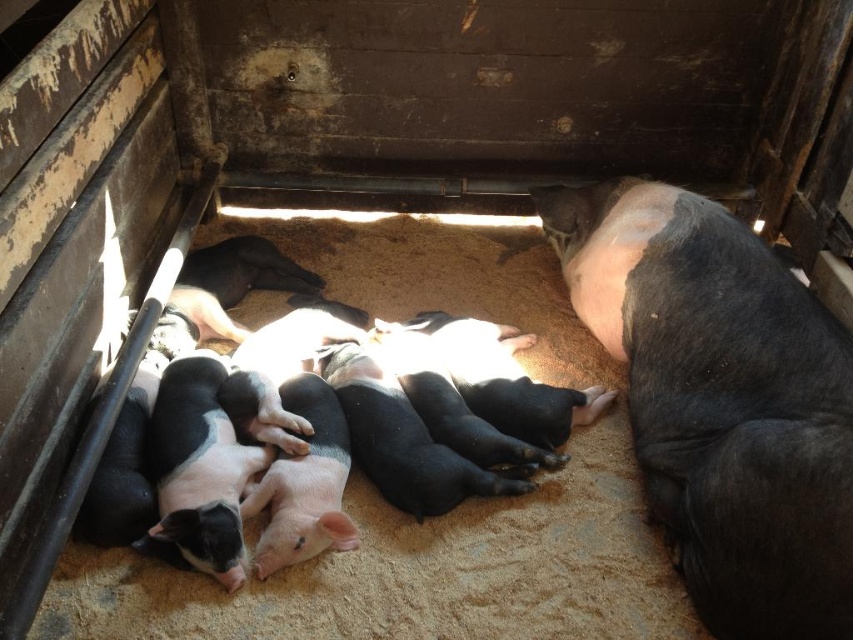
You are a farmer checking on your pigs. You notice the black matte pig at right and the black matte piglets at center. Which one is closer to you?

The black matte pig at right is closer to you because it is in front of the black matte piglets at center.

You are standing at the entrance of the wooden pen and see two points marked in the image. The first point is at coordinate point (755, 378) and the second is at point (90, 408). Which point is closer to you?

Point (755, 378) is in front of point (90, 408), so it is closer to you.